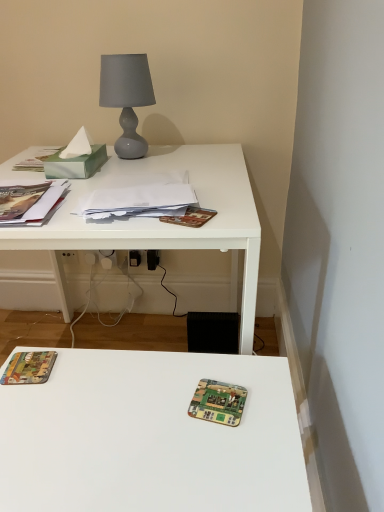
Identify the location of green circuit board at center. (218, 402).

This screenshot has width=384, height=512. What do you see at coordinates (29, 202) in the screenshot? I see `matte paper book at left` at bounding box center [29, 202].

Describe the element at coordinates (127, 97) in the screenshot. I see `matte gray glass lamp at upper center` at that location.

This screenshot has width=384, height=512. What do you see at coordinates (29, 368) in the screenshot?
I see `hardcover book at lower left, the 2th paperback book when ordered from top to bottom` at bounding box center [29, 368].

You are a GUI agent. You are given a task and a screenshot of the screen. Output one action in this format:
    pyautogui.click(x=<x>, y=<y>)
    Task: Click on the green circuit board at center
    
    Given the screenshot: What is the action you would take?
    pyautogui.click(x=218, y=402)

Considering the relative positions of matte gray glass lamp at upper center and brown textured paper at center, arranged as the second paperback book when viewed from the left, in the image provided, is matte gray glass lamp at upper center to the right of brown textured paper at center, arranged as the second paperback book when viewed from the left, from the viewer's perspective?

Incorrect, matte gray glass lamp at upper center is not on the right side of brown textured paper at center, arranged as the second paperback book when viewed from the left.

Would you say matte gray glass lamp at upper center is inside or outside brown textured paper at center, the first paperback book from the top?

matte gray glass lamp at upper center cannot be found inside brown textured paper at center, the first paperback book from the top.

Between point (128, 121) and point (208, 217), which one is positioned behind?

The point (128, 121) is more distant.

How much distance is there between matte gray glass lamp at upper center and brown textured paper at center, which is the first paperback book in right-to-left order?

A distance of 54.31 centimeters exists between matte gray glass lamp at upper center and brown textured paper at center, which is the first paperback book in right-to-left order.

From the image's perspective, is green circuit board at center positioned above or below matte paper book at left?

green circuit board at center is situated lower than matte paper book at left in the image.

Is green circuit board at center bigger or smaller than matte paper book at left?

Clearly, green circuit board at center is smaller in size than matte paper book at left.

Which object is thinner, green circuit board at center or matte paper book at left?

green circuit board at center.

Is brown textured paper at center, the first paperback book from the top, touching white matte desk at upper left?

brown textured paper at center, the first paperback book from the top, is not next to white matte desk at upper left, and they're not touching.

Could you measure the distance between brown textured paper at center, which is the first paperback book in right-to-left order, and white matte desk at upper left?

They are 11.48 inches apart.

Does brown textured paper at center, the first paperback book from the top, turn towards white matte desk at upper left?

No, brown textured paper at center, the first paperback book from the top, is not aimed at white matte desk at upper left.

Is brown textured paper at center, which is the first paperback book in right-to-left order, completely or partially outside of white matte desk at upper left?

No.

Is white paper stack at center bigger or smaller than green circuit board at center?

white paper stack at center is bigger than green circuit board at center.

Is point (135, 192) less distant than point (238, 401)?

No, (135, 192) is behind (238, 401).

Where is `card game that appears in front of the white paper stack at center`? card game that appears in front of the white paper stack at center is located at coordinates (218, 402).

Looking at their sizes, would you say hardcover book at lower left, the first paperback book when ordered from left to right, is wider or thinner than white paper stack at center?

In the image, hardcover book at lower left, the first paperback book when ordered from left to right, appears to be more narrow than white paper stack at center.

Which is correct: hardcover book at lower left, the 2th paperback book when ordered from top to bottom, is inside white paper stack at center, or outside of it?

hardcover book at lower left, the 2th paperback book when ordered from top to bottom, is spatially situated outside white paper stack at center.

From a real-world perspective, is hardcover book at lower left, the second paperback book in the right-to-left sequence, positioned under white paper stack at center based on gravity?

Correct, in the physical world, hardcover book at lower left, the second paperback book in the right-to-left sequence, is lower than white paper stack at center.

Can you confirm if hardcover book at lower left, the second paperback book in the right-to-left sequence, is shorter than white paper stack at center?

Correct, hardcover book at lower left, the second paperback book in the right-to-left sequence, is not as tall as white paper stack at center.

Considering the sizes of objects white paper stack at center and matte paper book at left in the image provided, who is bigger, white paper stack at center or matte paper book at left?

Bigger between the two is matte paper book at left.

Is white paper stack at center positioned with its back to matte paper book at left?

white paper stack at center does not have its back to matte paper book at left.

Does white paper stack at center touch matte paper book at left?

No, white paper stack at center is not touching matte paper book at left.

Based on the photo, from a real-world perspective, is white paper stack at center on top of matte paper book at left?

Incorrect, from a real-world perspective, white paper stack at center is lower than matte paper book at left.

Consider the image. From a real-world perspective, is green circuit board at center on top of white matte desk at upper left?

Yes, from a real-world perspective, green circuit board at center is over white matte desk at upper left

From the image's perspective, which is below, green circuit board at center or white matte desk at upper left?

From the image's view, green circuit board at center is below.

Is point (199, 390) farther from camera compared to point (243, 325)?

No, it is not.

Is green circuit board at center positioned before white matte desk at upper left?

Yes, green circuit board at center is closer to the camera.

The width and height of the screenshot is (384, 512). Find the location of `lamp that appears above the brown textured paper at center, which is the first paperback book in right-to-left order (from the image's perspective)`. lamp that appears above the brown textured paper at center, which is the first paperback book in right-to-left order (from the image's perspective) is located at coordinates (127, 97).

This screenshot has width=384, height=512. In order to click on card game below the matte paper book at left (from a real-world perspective) in this screenshot , I will do `click(218, 402)`.

Based on their spatial positions, is hardcover book at lower left, the second paperback book in the right-to-left sequence, or white matte desk at upper left further from matte gray glass lamp at upper center?

The object further to matte gray glass lamp at upper center is hardcover book at lower left, the second paperback book in the right-to-left sequence.

Estimate the real-world distances between objects in this image. Which object is further from matte paper book at left, brown textured paper at center, the 2th paperback book when ordered from bottom to top, or white matte desk at upper left?

The object further to matte paper book at left is brown textured paper at center, the 2th paperback book when ordered from bottom to top.

Considering their positions, is green circuit board at center positioned further to white matte desk at upper left than brown textured paper at center, the first paperback book from the top?

green circuit board at center.

Based on their spatial positions, is brown textured paper at center, which is the first paperback book in right-to-left order, or green circuit board at center further from matte paper book at left?

Based on the image, green circuit board at center appears to be further to matte paper book at left.

Estimate the real-world distances between objects in this image. Which object is further from matte gray glass lamp at upper center, matte paper book at left or green circuit board at center?

green circuit board at center lies further to matte gray glass lamp at upper center than the other object.

Based on their spatial positions, is matte paper book at left or matte gray glass lamp at upper center closer to brown textured paper at center, arranged as the second paperback book when viewed from the left?

matte paper book at left.

From the image, which object appears to be nearer to brown textured paper at center, the 2th paperback book when ordered from bottom to top, white matte desk at upper left or matte gray glass lamp at upper center?

white matte desk at upper left lies closer to brown textured paper at center, the 2th paperback book when ordered from bottom to top, than the other object.

Based on their spatial positions, is white matte desk at upper left or green circuit board at center closer to matte gray glass lamp at upper center?

The object closer to matte gray glass lamp at upper center is white matte desk at upper left.

You are a GUI agent. You are given a task and a screenshot of the screen. Output one action in this format:
    pyautogui.click(x=<x>, y=<y>)
    Task: Click on the journal between matte gray glass lamp at upper center and hardcover book at lower left, the second paperback book in the right-to-left sequence, in the up-down direction
    The width and height of the screenshot is (384, 512).
    Given the screenshot: What is the action you would take?
    pyautogui.click(x=138, y=201)

In order to click on journal between matte gray glass lamp at upper center and green circuit board at center in the vertical direction in this screenshot , I will do `click(138, 201)`.

This screenshot has width=384, height=512. Identify the location of desk between matte paper book at left and brown textured paper at center, the first paperback book from the top. (164, 223).

Where is `book between matte gray glass lamp at upper center and hardcover book at lower left, the 2th paperback book when ordered from top to bottom, in the up-down direction`? The image size is (384, 512). book between matte gray glass lamp at upper center and hardcover book at lower left, the 2th paperback book when ordered from top to bottom, in the up-down direction is located at coordinates (29, 202).